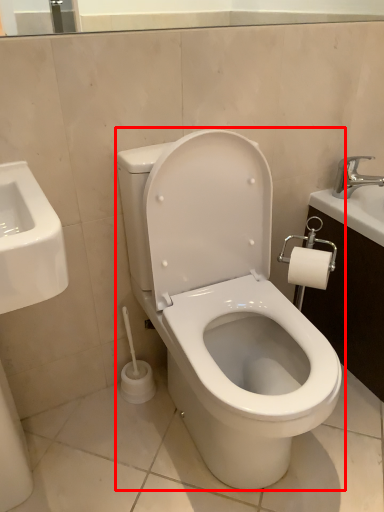
Question: Considering the relative positions of toilet (annotated by the red box) and tap in the image provided, where is toilet (annotated by the red box) located with respect to the staircase?

Choices:
 (A) right
 (B) left

Answer: (B)